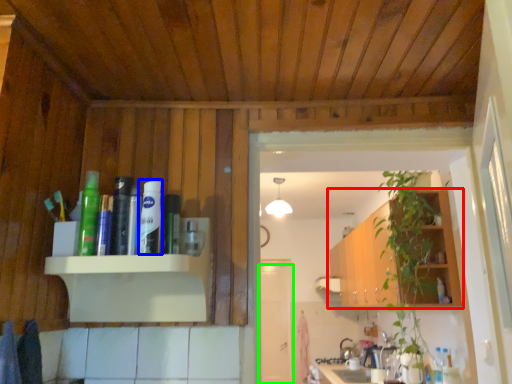
Question: Considering the real-world distances, which object is closest to cabinetry (highlighted by a red box)? toiletry (highlighted by a blue box) or door (highlighted by a green box).

Choices:
 (A) toiletry
 (B) door

Answer: (B)